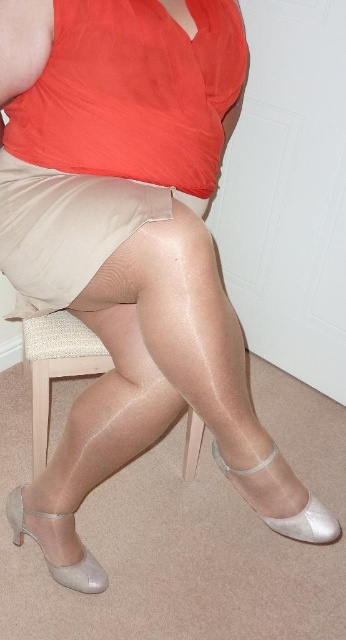
You are standing in the room and want to move from the point at coordinates point (52, 477) to the point at coordinates point (213, 444). Which direction should you move in?

You should move forward towards the point at coordinates point (213, 444) since point (52, 477) is behind it.

From the picture: You are an interior designer analyzing the spatial arrangement of the room. The person is sitting on a wooden chair with a light colored cushion. You need to place a decorative pillow exactly 0.1 units to the right of the satin beige skirt at center. Where should you place the decorative pillow in 2D coordinates?

The 2D location of the satin beige skirt at center is at point (112, 134). To place the decorative pillow exactly 0.1 units to the right, add 0.1 to the x coordinate. The new coordinates would be (112, 198).

You are a fashion designer analyzing the image. You need to determine the exact position of the satin beige skirt at center in the image. What are the coordinates of the skirt?

The coordinates of the satin beige skirt at center are at point (112, 134).